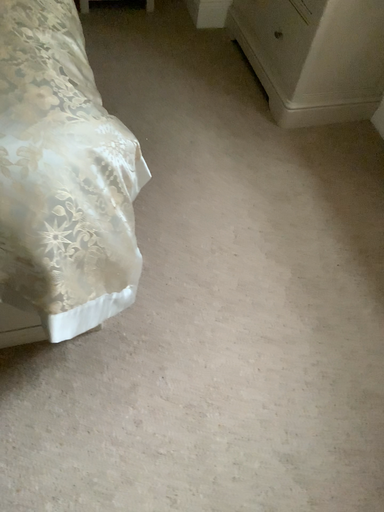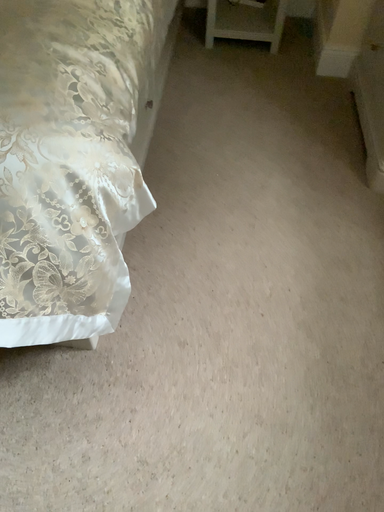
Question: Which way did the camera rotate in the video?

Choices:
 (A) rotated downward
 (B) rotated upward

Answer: (B)